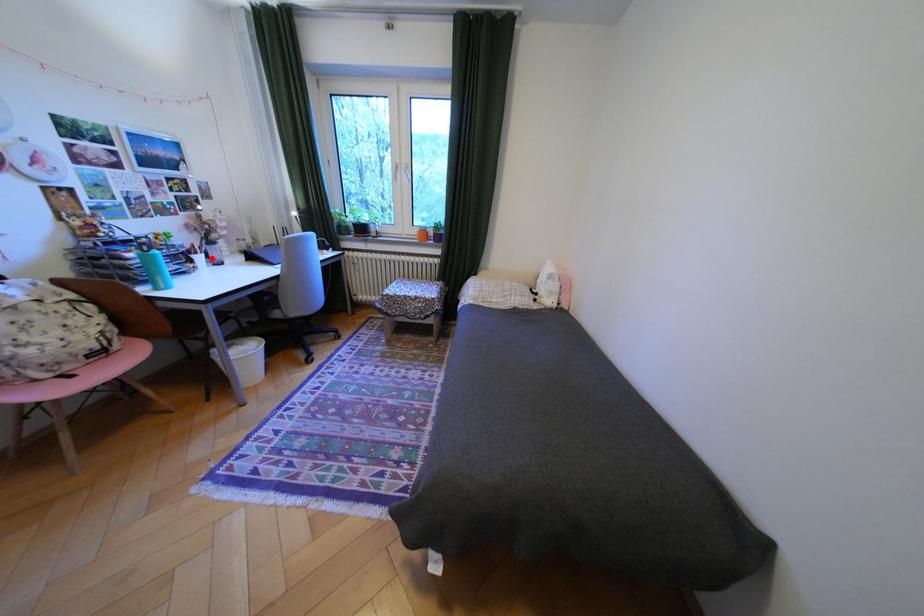
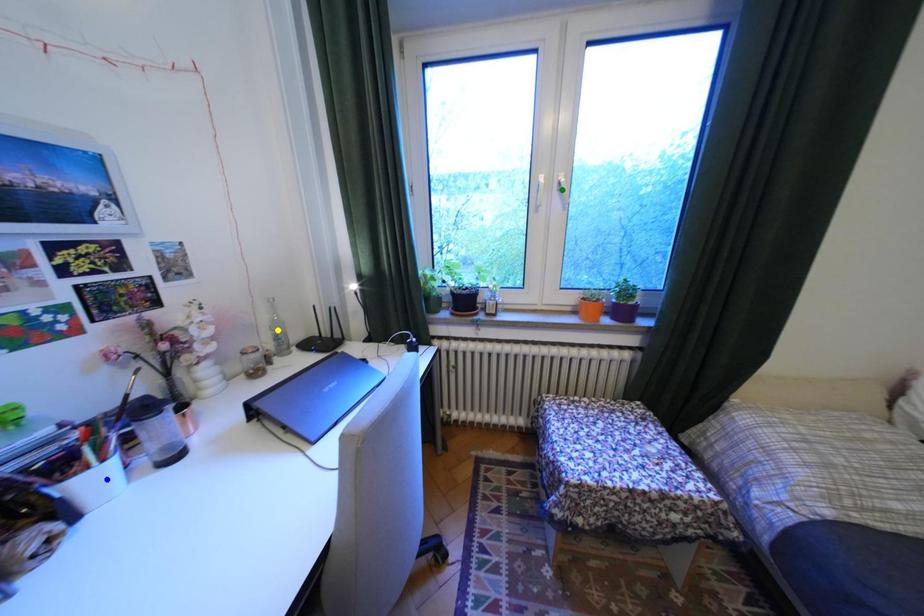
Question: I am providing you with two images of the same scene from different viewpoints. A red point is marked on the first image. You are given multiple points on the second image. Can you choose the point in image 2 that corresponds to the point in image 1?

Choices:
 (A) blue point
 (B) yellow point
 (C) green point

Answer: (A)